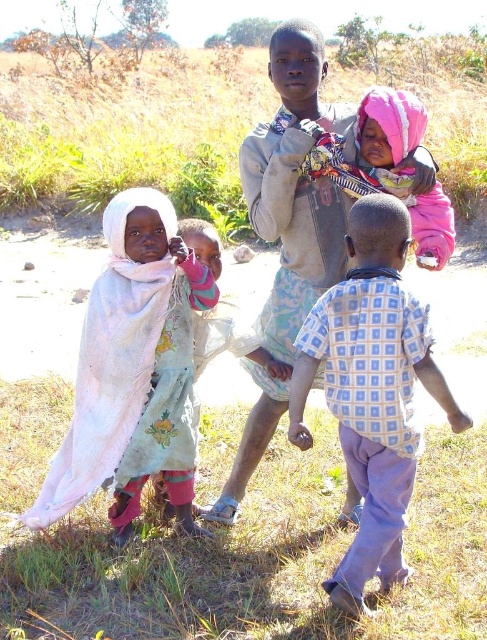
Is blue checkered shirt at center shorter than pink fabric scarf at upper center?

No, blue checkered shirt at center is not shorter than pink fabric scarf at upper center.

Who is higher up, blue checkered shirt at center or pink fabric scarf at upper center?

pink fabric scarf at upper center is higher up.

Is point (379, 525) farther from viewer compared to point (299, 28)?

No, (379, 525) is closer to viewer.

The height and width of the screenshot is (640, 487). What are the coordinates of `blue checkered shirt at center` in the screenshot? It's located at (372, 388).